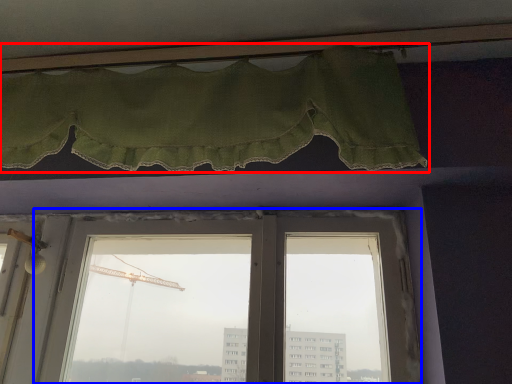
Question: Which object is closer to the camera taking this photo, curtain (highlighted by a red box) or window (highlighted by a blue box)?

Choices:
 (A) curtain
 (B) window

Answer: (A)